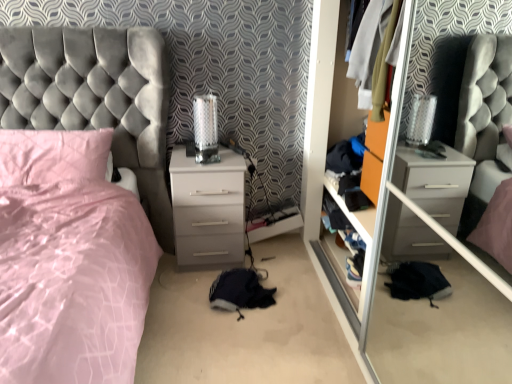
Measure the distance between transparent glass door at center and camera.

A distance of 1.43 meters exists between transparent glass door at center and camera.

The image size is (512, 384). What are the coordinates of `transparent glass door at center` in the screenshot? It's located at (369, 214).

From a real-world perspective, is wooden shelf at center on top of transparent glass door at center?

Incorrect, from a real-world perspective, wooden shelf at center is lower than transparent glass door at center.

From the image's perspective, is wooden shelf at center positioned above or below transparent glass door at center?

Clearly, from the image's perspective, wooden shelf at center is below transparent glass door at center.

Is wooden shelf at center positioned far away from transparent glass door at center?

No, wooden shelf at center is not far from transparent glass door at center.

Can you confirm if wooden shelf at center is wider than transparent glass door at center?

No, wooden shelf at center is not wider than transparent glass door at center.

How many degrees apart are the facing directions of satin pink pillow at left and velvet grey bed at left?

1.19 degrees.

Considering the points (17, 162) and (60, 201), which point is in front, point (17, 162) or point (60, 201)?

The point (60, 201) is more forward.

From the image's perspective, would you say satin pink pillow at left is shown under velvet grey bed at left?

No, from the image's perspective, satin pink pillow at left is not beneath velvet grey bed at left.

Who is taller, satin pink pillow at left or velvet grey bed at left?

velvet grey bed at left is taller.

Who is shorter, white glossy chest of drawers at center or satin pink pillow at left?

satin pink pillow at left.

Is white glossy chest of drawers at center directly adjacent to satin pink pillow at left?

No.

Do you think white glossy chest of drawers at center is within satin pink pillow at left, or outside of it?

white glossy chest of drawers at center is not enclosed by satin pink pillow at left.

Is point (201, 218) farther from camera compared to point (11, 171)?

Yes, point (201, 218) is farther from viewer.

Measure the distance from satin pink pillow at left to wooden shelf at center.

satin pink pillow at left is 4.88 feet away from wooden shelf at center.

Which of these two, satin pink pillow at left or wooden shelf at center, is thinner?

wooden shelf at center is thinner.

Choose the correct answer: Is satin pink pillow at left inside wooden shelf at center or outside it?

satin pink pillow at left lies outside wooden shelf at center.

Is satin pink pillow at left oriented towards wooden shelf at center?

No, satin pink pillow at left is not aimed at wooden shelf at center.

Is satin pink pillow at left surrounding white glossy chest of drawers at center?

No, satin pink pillow at left does not contain white glossy chest of drawers at center.

Consider the image. From the image's perspective, is satin pink pillow at left located beneath white glossy chest of drawers at center?

No.

The width and height of the screenshot is (512, 384). In order to click on pillow that is above the white glossy chest of drawers at center (from a real-world perspective) in this screenshot , I will do `click(52, 155)`.

Which object is positioned more to the right, satin pink pillow at left or white glossy chest of drawers at center?

From the viewer's perspective, white glossy chest of drawers at center appears more on the right side.

You are a GUI agent. You are given a task and a screenshot of the screen. Output one action in this format:
    pyautogui.click(x=<x>, y=<y>)
    Task: Click on the bed above the wooden shelf at center (from a real-world perspective)
    The width and height of the screenshot is (512, 384).
    Given the screenshot: What is the action you would take?
    pyautogui.click(x=74, y=205)

From a real-world perspective, between velvet grey bed at left and wooden shelf at center, who is vertically lower?

wooden shelf at center is physically lower.

Considering the positions of objects velvet grey bed at left and wooden shelf at center in the image provided, who is more to the left, velvet grey bed at left or wooden shelf at center?

velvet grey bed at left is more to the left.

Is velvet grey bed at left situated inside wooden shelf at center or outside?

velvet grey bed at left exists outside the volume of wooden shelf at center.

Is wooden shelf at center far away from satin pink pillow at left?

Absolutely, wooden shelf at center is distant from satin pink pillow at left.

Looking at this image, who is smaller, wooden shelf at center or satin pink pillow at left?

Smaller between the two is wooden shelf at center.

Which of these two, wooden shelf at center or satin pink pillow at left, stands shorter?

Standing shorter between the two is satin pink pillow at left.

Does wooden shelf at center turn towards satin pink pillow at left?

Yes, wooden shelf at center faces towards satin pink pillow at left.

Where is `shelf below the transparent glass door at center (from the image's perspective)`? shelf below the transparent glass door at center (from the image's perspective) is located at coordinates (340, 266).

Where is `bed positioned vertically above the satin pink pillow at left (from a real-world perspective)`? bed positioned vertically above the satin pink pillow at left (from a real-world perspective) is located at coordinates (74, 205).

Considering their positions, is white glossy chest of drawers at center positioned closer to transparent glass door at center than velvet grey bed at left?

white glossy chest of drawers at center lies closer to transparent glass door at center than the other object.

When comparing their distances from wooden shelf at center, does velvet grey bed at left or satin pink pillow at left seem further?

Based on the image, satin pink pillow at left appears to be further to wooden shelf at center.

Considering their positions, is transparent glass door at center positioned further to white glossy chest of drawers at center than wooden shelf at center?

The object further to white glossy chest of drawers at center is wooden shelf at center.

Estimate the real-world distances between objects in this image. Which object is further from satin pink pillow at left, wooden shelf at center or white glossy chest of drawers at center?

Among the two, wooden shelf at center is located further to satin pink pillow at left.

From the image, which object appears to be nearer to satin pink pillow at left, white glossy chest of drawers at center or wooden shelf at center?

white glossy chest of drawers at center is closer to satin pink pillow at left.

Looking at the image, which one is located closer to velvet grey bed at left, wooden shelf at center or transparent glass door at center?

transparent glass door at center is closer to velvet grey bed at left.

Looking at the image, which one is located closer to transparent glass door at center, satin pink pillow at left or velvet grey bed at left?

velvet grey bed at left is closer to transparent glass door at center.

Looking at the image, which one is located closer to white glossy chest of drawers at center, satin pink pillow at left or transparent glass door at center?

satin pink pillow at left is closer to white glossy chest of drawers at center.

Image resolution: width=512 pixels, height=384 pixels. I want to click on shelf between transparent glass door at center and white glossy chest of drawers at center in the front-back direction, so click(x=340, y=266).

This screenshot has width=512, height=384. In order to click on chest of drawers between satin pink pillow at left and transparent glass door at center in this screenshot , I will do `click(208, 208)`.

In order to click on shelf located between velvet grey bed at left and satin pink pillow at left in the depth direction in this screenshot , I will do `click(340, 266)`.

Find the location of `glass door between velvet grey bed at left and white glossy chest of drawers at center from front to back`. glass door between velvet grey bed at left and white glossy chest of drawers at center from front to back is located at coordinates (369, 214).